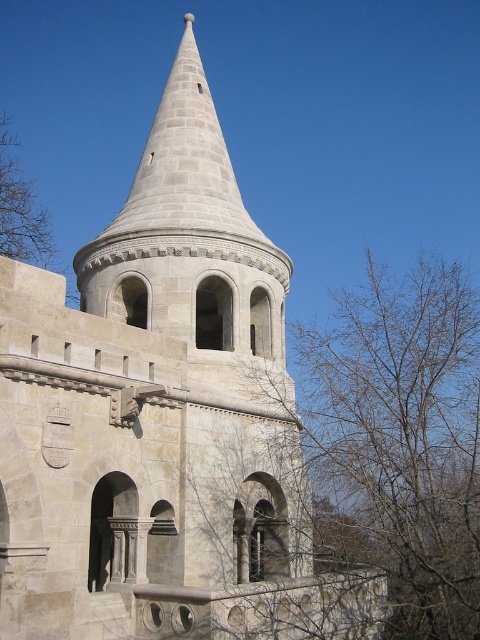
Question: Is bare branches at lower right to the left of brown leafless tree at upper left from the viewer's perspective?

Choices:
 (A) yes
 (B) no

Answer: (B)

Question: Does bare branches at lower right appear on the right side of brown leafless tree at upper left?

Choices:
 (A) no
 (B) yes

Answer: (B)

Question: Which point appears farthest from the camera in this image?

Choices:
 (A) (0, 208)
 (B) (359, 344)

Answer: (B)

Question: Which point appears closest to the camera in this image?

Choices:
 (A) (11, 141)
 (B) (363, 488)

Answer: (B)

Question: Does bare branches at lower right appear on the left side of brown leafless tree at upper left?

Choices:
 (A) no
 (B) yes

Answer: (A)